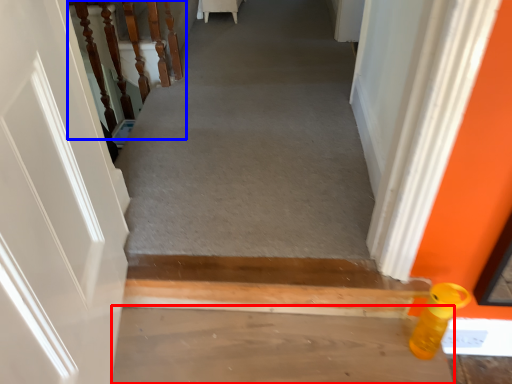
Question: Which point is further to the camera, concrete (highlighted by a red box) or stairwell (highlighted by a blue box)?

Choices:
 (A) concrete
 (B) stairwell

Answer: (B)